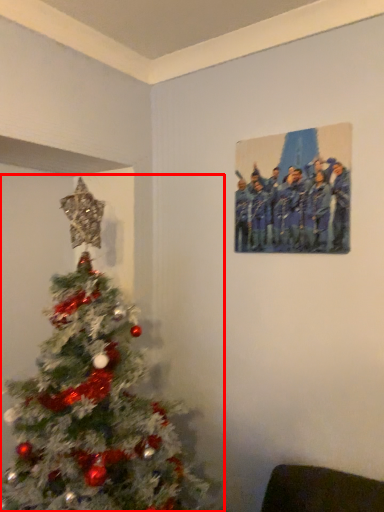
Question: From the image, what is the correct spatial relationship of christmas tree (annotated by the red box) in relation to picture frame?

Choices:
 (A) left
 (B) right

Answer: (A)